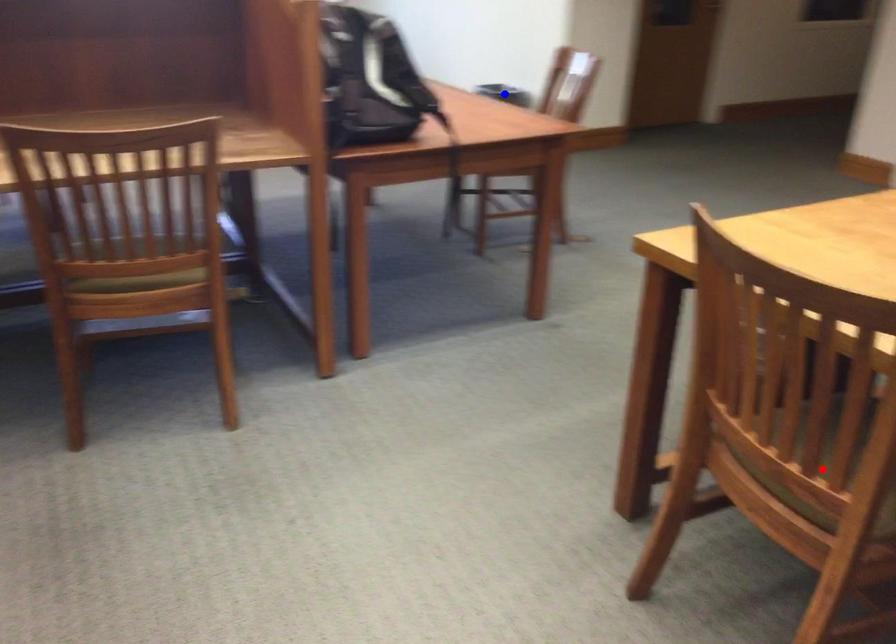
Question: Two points are marked on the image. Which point is closer to the camera?

Choices:
 (A) Blue point is closer.
 (B) Red point is closer.

Answer: (B)